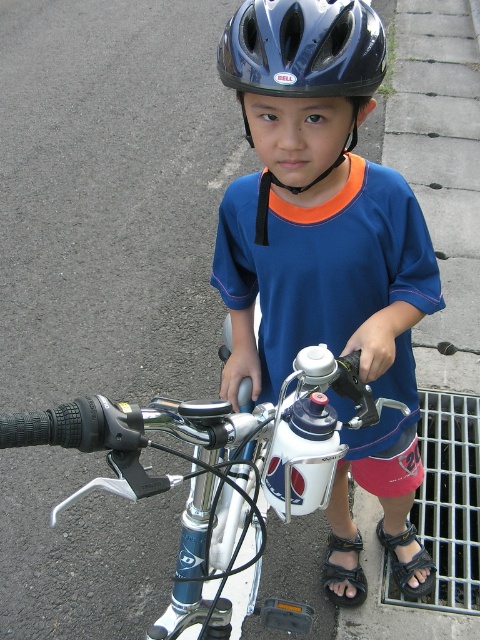
Between white metallic bicycle at center and black leather sandal at lower center, which one appears on the right side from the viewer's perspective?

Positioned to the right is black leather sandal at lower center.

Does white metallic bicycle at center have a smaller size compared to black leather sandal at lower center?

Actually, white metallic bicycle at center might be larger than black leather sandal at lower center.

The height and width of the screenshot is (640, 480). I want to click on white metallic bicycle at center, so click(x=218, y=472).

Identify the location of white metallic bicycle at center. Image resolution: width=480 pixels, height=640 pixels. (218, 472).

Can you confirm if white metallic bicycle at center is thinner than black leather sandal at lower right?

No, white metallic bicycle at center is not thinner than black leather sandal at lower right.

Is white metallic bicycle at center below black leather sandal at lower right?

Incorrect, white metallic bicycle at center is not positioned below black leather sandal at lower right.

Is point (214, 497) less distant than point (418, 564)?

Yes.

Find the location of a particular element. The width and height of the screenshot is (480, 640). white metallic bicycle at center is located at coordinates (218, 472).

Is white metallic bicycle at center below black matte helmet at center?

Correct, white metallic bicycle at center is located below black matte helmet at center.

Who is lower down, white metallic bicycle at center or black matte helmet at center?

white metallic bicycle at center is lower down.

Describe the element at coordinates (218, 472) in the screenshot. I see `white metallic bicycle at center` at that location.

Image resolution: width=480 pixels, height=640 pixels. I want to click on white metallic bicycle at center, so click(x=218, y=472).